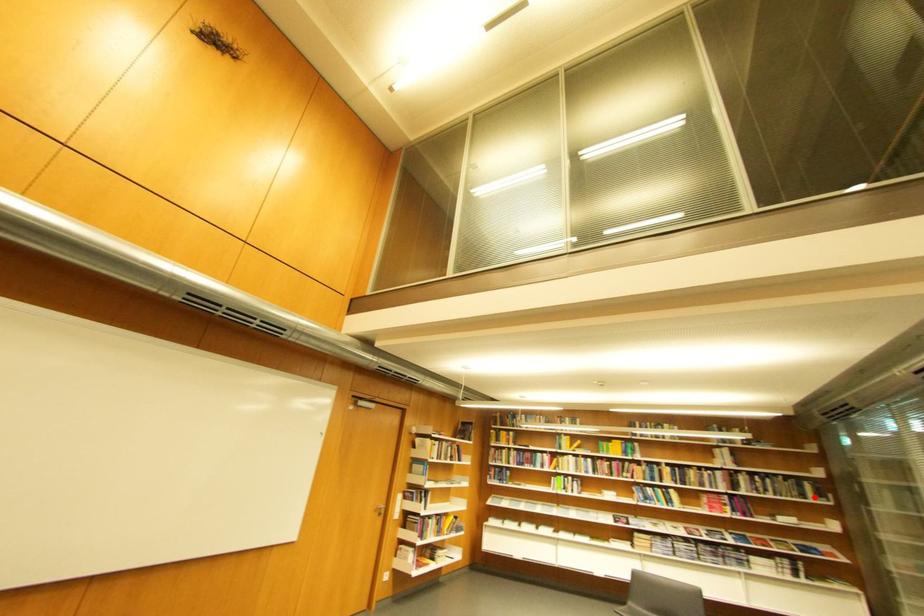
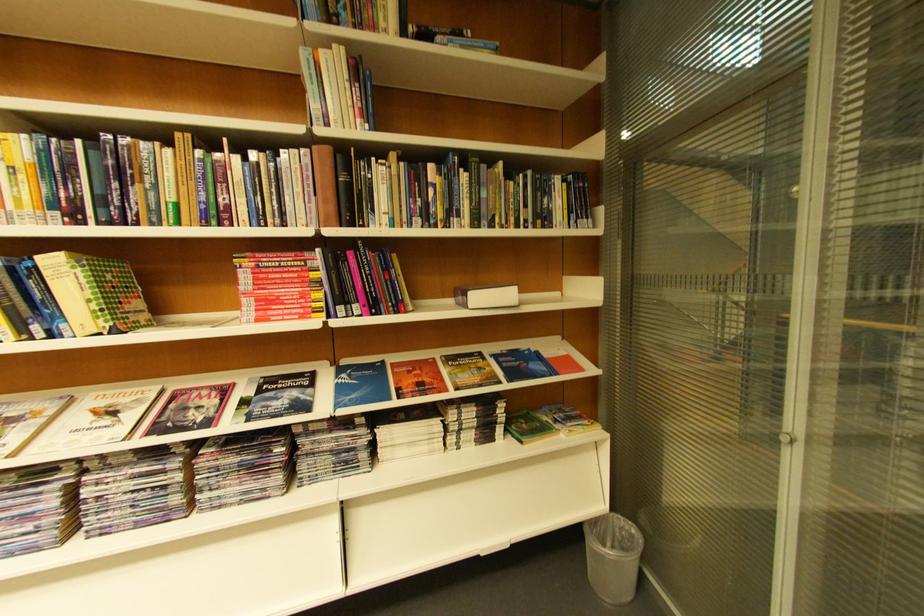
Question: A red point is marked in image1. In image2, is the corresponding 3D point closer to the camera or farther? Reply with the corresponding letter.

Choices:
 (A) The corresponding 3D point is closer.
 (B) The corresponding 3D point is farther.

Answer: (B)